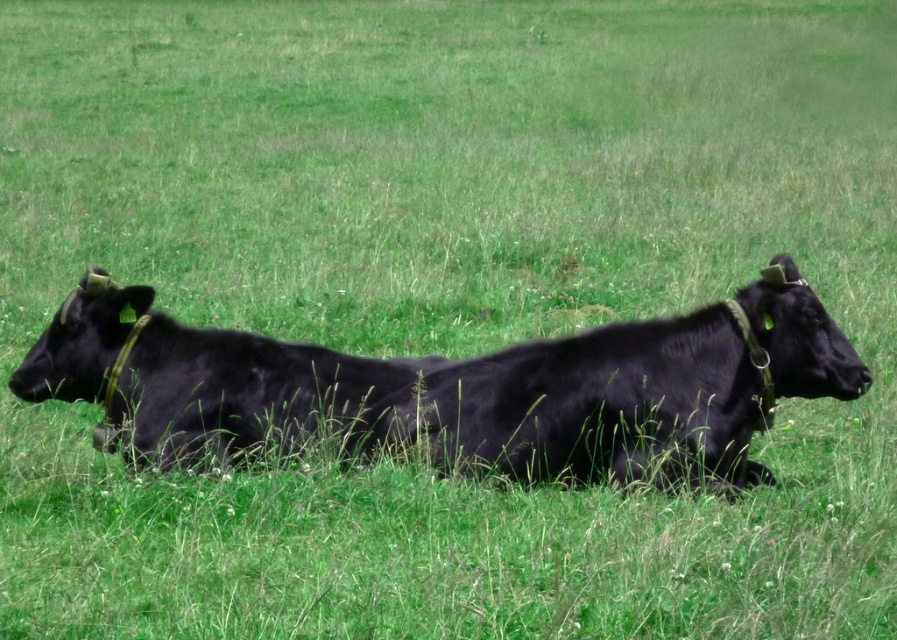
Does point (377, 385) come closer to viewer compared to point (172, 403)?

No.

At what (x,y) coordinates should I click in order to perform the action: click on black smooth cow at center. Please return your answer as a coordinate pair (x, y). This screenshot has height=640, width=897. Looking at the image, I should click on (464, 387).